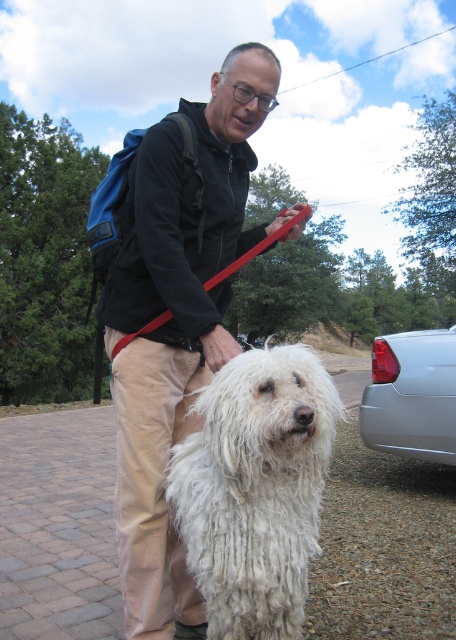
Question: Among these points, which one is nearest to the camera?

Choices:
 (A) [441, 337]
 (B) [214, 176]
 (C) [304, 557]
 (D) [250, 259]

Answer: (C)

Question: Considering the real-world distances, which object is farthest from the black matte jacket at center?

Choices:
 (A) satin silver car at right
 (B) red rubber leash at center

Answer: (A)

Question: Which is farther from the red rubber leash at center?

Choices:
 (A) satin silver car at right
 (B) white fluffy dog at center

Answer: (A)

Question: From the image, what is the correct spatial relationship of white fluffy dog at center in relation to red rubber leash at center?

Choices:
 (A) below
 (B) above

Answer: (A)

Question: Where is black matte jacket at center located in relation to red rubber leash at center in the image?

Choices:
 (A) right
 (B) left

Answer: (B)

Question: Does satin silver car at right come behind red rubber leash at center?

Choices:
 (A) yes
 (B) no

Answer: (A)